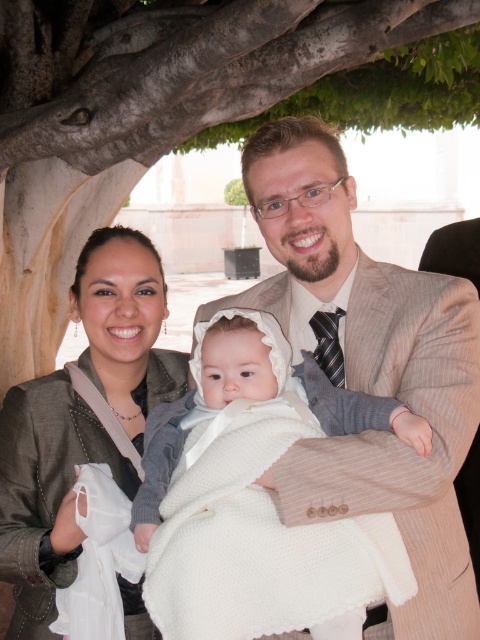
You are a photographer who wants to ensure the light brown striped suit at center is fully visible in the photo. Given the brown textured tree trunk at upper center is blocking part of the view, what adjustment should you make to the camera angle?

The brown textured tree trunk at upper center is above the light brown striped suit at center, so lowering the camera angle would help ensure the suit remains fully visible without obstruction from the tree trunk.

You are a photographer setting up a shot for a family portrait. You have a white knitted blanket at center and a matte gray jacket at center in the scene. Which object should you adjust if you want to ensure that the blanket covers more of the frame horizontally compared to the jacket?

The white knitted blanket at center has a larger width than the matte gray jacket at center, so it already covers more of the frame horizontally. No adjustment is needed if the goal is to have the blanket cover more than the jacket.

You are standing in the family portrait scene. The photographer wants to adjust the lighting to highlight the brown textured tree trunk at upper center. Since the trunk is located at point 0.175, 0.350 in the image coordinates, where exactly should the photographer aim the spotlight to ensure it hits the trunk?

The photographer should aim the spotlight at point (168, 112) in the image coordinates to hit the brown textured tree trunk at upper center.